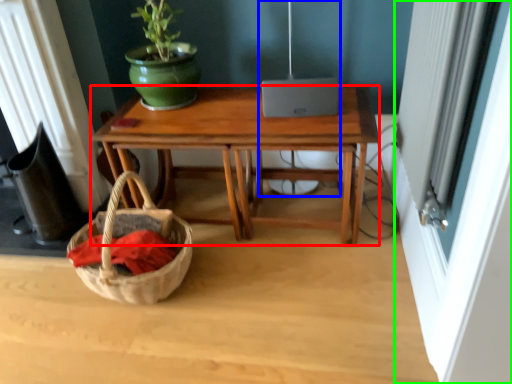
Question: Considering the real-world distances, which object is farthest from desk (highlighted by a red box)? lamp (highlighted by a blue box) or screen door (highlighted by a green box)?

Choices:
 (A) lamp
 (B) screen door

Answer: (B)